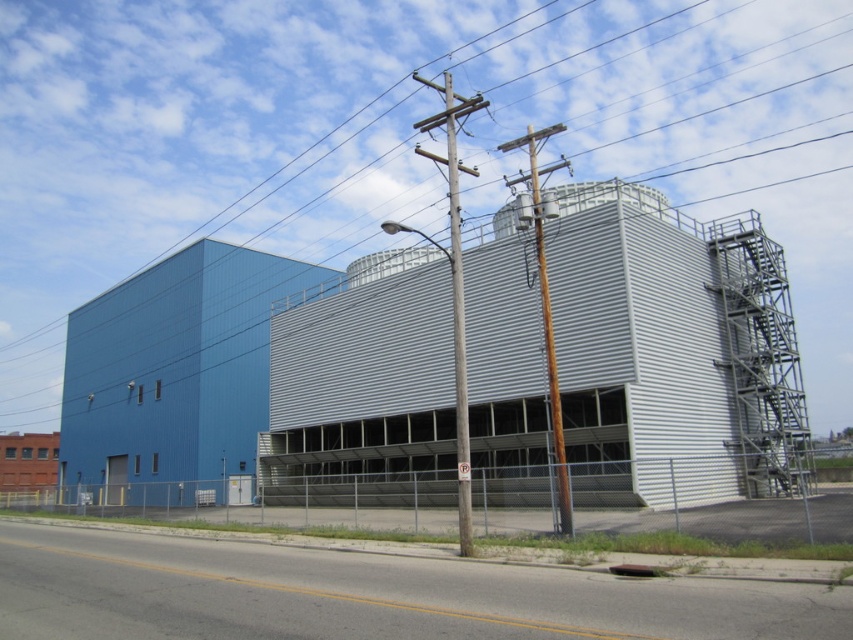
Question: Which point appears farthest from the camera in this image?

Choices:
 (A) (471, 532)
 (B) (4, 58)

Answer: (B)

Question: Which object appears closest to the camera in this image?

Choices:
 (A) metallic wire at upper center
 (B) wooden utility pole at center

Answer: (B)

Question: Is metallic wire at upper center thinner than wooden utility pole at center?

Choices:
 (A) no
 (B) yes

Answer: (A)

Question: Which point is closer to the camera?

Choices:
 (A) metallic wire at upper center
 (B) wooden utility pole at center

Answer: (B)

Question: Can you confirm if metallic wire at upper center is smaller than wooden utility pole at center?

Choices:
 (A) yes
 (B) no

Answer: (B)

Question: Can you confirm if metallic wire at upper center is bigger than wooden utility pole at center?

Choices:
 (A) no
 (B) yes

Answer: (B)